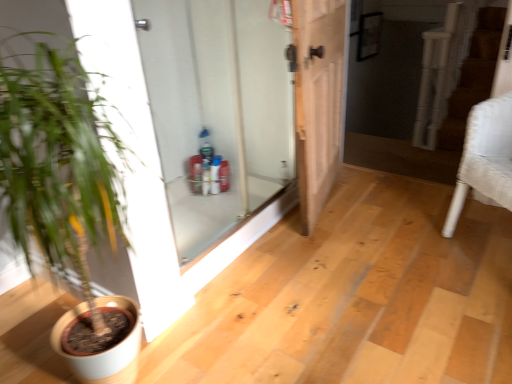
Question: Considering the relative sizes of white textured armchair at right and white matte pot at left in the image provided, is white textured armchair at right bigger than white matte pot at left?

Choices:
 (A) yes
 (B) no

Answer: (B)

Question: Does white textured armchair at right touch white matte pot at left?

Choices:
 (A) yes
 (B) no

Answer: (B)

Question: Does white textured armchair at right lie behind white matte pot at left?

Choices:
 (A) no
 (B) yes

Answer: (B)

Question: Can white matte pot at left be found inside white textured armchair at right?

Choices:
 (A) no
 (B) yes

Answer: (A)

Question: Is there a large distance between white textured armchair at right and white matte pot at left?

Choices:
 (A) yes
 (B) no

Answer: (A)

Question: Is point (101, 177) positioned closer to the camera than point (153, 46)?

Choices:
 (A) farther
 (B) closer

Answer: (B)

Question: Is white matte pot at left spatially inside white glass door at center, the second door viewed from the right, or outside of it?

Choices:
 (A) inside
 (B) outside

Answer: (B)

Question: In terms of width, does white matte pot at left look wider or thinner when compared to white glass door at center, acting as the first door starting from the left?

Choices:
 (A) thin
 (B) wide

Answer: (B)

Question: From the image's perspective, is white matte pot at left located above or below white glass door at center, acting as the first door starting from the left?

Choices:
 (A) above
 (B) below

Answer: (B)

Question: Is white matte pot at left bigger or smaller than light brown wooden door at center, which appears as the 1th door when viewed from the right?

Choices:
 (A) big
 (B) small

Answer: (A)

Question: From a real-world perspective, is white matte pot at left physically located above or below light brown wooden door at center, which appears as the 1th door when viewed from the right?

Choices:
 (A) above
 (B) below

Answer: (A)

Question: Visually, is white matte pot at left positioned to the left or to the right of light brown wooden door at center, which appears as the 1th door when viewed from the right?

Choices:
 (A) right
 (B) left

Answer: (B)

Question: Considering their positions, is white matte pot at left located in front of or behind light brown wooden door at center, which appears as the 1th door when viewed from the right?

Choices:
 (A) behind
 (B) front

Answer: (B)

Question: From the image's perspective, is white textured armchair at right above or below white matte pot at left?

Choices:
 (A) below
 (B) above

Answer: (B)

Question: Is white textured armchair at right wider or thinner than white matte pot at left?

Choices:
 (A) wide
 (B) thin

Answer: (B)